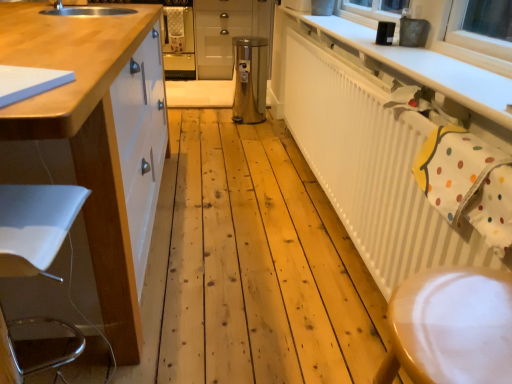
Question: From a real-world perspective, is white glossy cabinet at left, which appears as the first cabinetry when ordered from the bottom, physically located above or below white textured radiator at upper right?

Choices:
 (A) below
 (B) above

Answer: (B)

Question: From the image's perspective, relative to white textured radiator at upper right, is white glossy cabinet at left, the second cabinetry positioned from the back, above or below?

Choices:
 (A) above
 (B) below

Answer: (B)

Question: Considering the real-world distances, which object is closest to the stainless steel trash can at center?

Choices:
 (A) metallic silver cabinet at center, the 2th cabinetry in the front-to-back sequence
 (B) white textured radiator at upper right
 (C) white matte countertop at upper right
 (D) wooden step stool at lower right
 (E) white glossy cabinet at left, marked as the 1th cabinetry in a front-to-back arrangement

Answer: (A)

Question: Estimate the real-world distances between objects in this image. Which object is closer to the wooden step stool at lower right?

Choices:
 (A) stainless steel trash can at center
 (B) white glossy cabinet at left, which is counted as the second cabinetry, starting from the top
 (C) white textured radiator at upper right
 (D) white matte countertop at upper right
 (E) metallic silver cabinet at center, placed as the 1th cabinetry when sorted from back to front

Answer: (C)